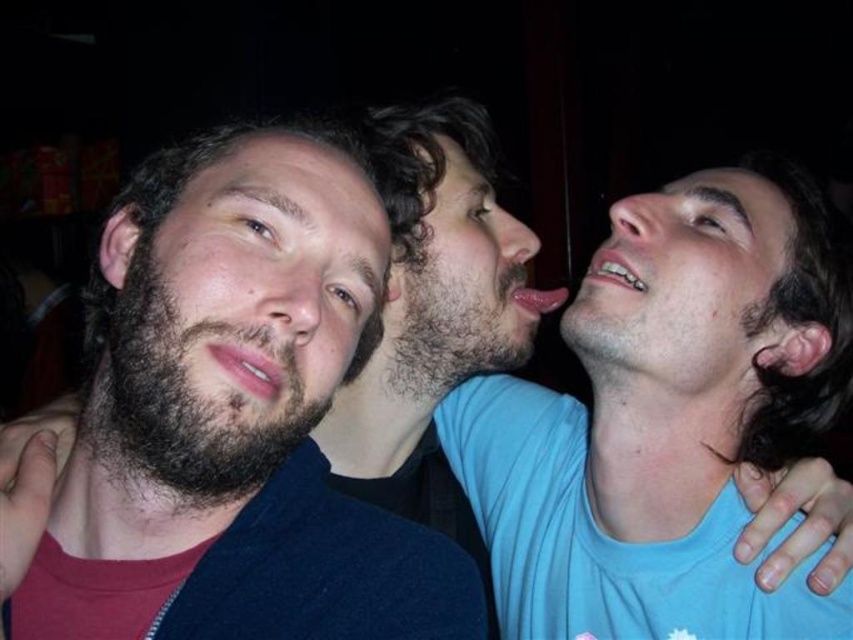
You are standing at the point labeled as point (434, 248) in the image. You want to take a photo of the three people in the scene using a camera that has a maximum focus range of 1 meter. Will the camera be able to focus on the three people if you are at that point?

The distance between the point (434, 248) and the camera is 1.03 meters, which is slightly beyond the camera maximum focus range of 1 meter. Therefore, the camera will not be able to focus on the three people from that point.